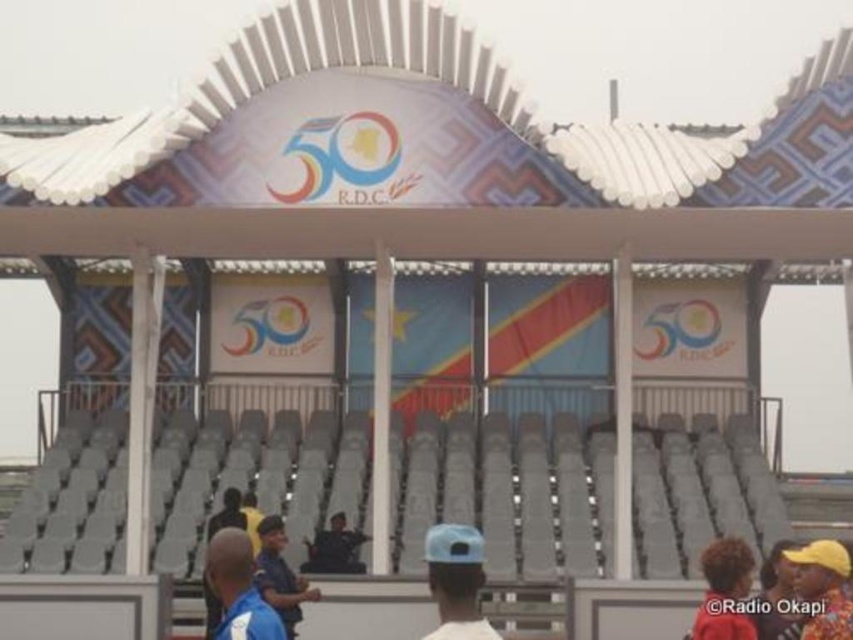
Consider the image. Does yellow fabric hat at upper right have a greater height compared to yellow fabric cap at lower right?

Yes, yellow fabric hat at upper right is taller than yellow fabric cap at lower right.

What do you see at coordinates (822, 588) in the screenshot? This screenshot has width=853, height=640. I see `yellow fabric hat at upper right` at bounding box center [822, 588].

At what (x,y) coordinates should I click in order to perform the action: click on yellow fabric hat at upper right. Please return your answer as a coordinate pair (x, y). This screenshot has height=640, width=853. Looking at the image, I should click on point(822,588).

What do you see at coordinates (546, 497) in the screenshot? This screenshot has height=640, width=853. I see `gray plastic seats at lower center` at bounding box center [546, 497].

Which is behind, point (683, 452) or point (234, 572)?

The point (683, 452) is behind.

Is point (270, 486) positioned behind point (231, 621)?

Yes, point (270, 486) is behind point (231, 621).

You are a GUI agent. You are given a task and a screenshot of the screen. Output one action in this format:
    pyautogui.click(x=<x>, y=<y>)
    Task: Click on the gray plastic seats at lower center
    
    Given the screenshot: What is the action you would take?
    pyautogui.click(x=546, y=497)

Between point (442, 528) and point (740, 614), which one is positioned in front?

Point (442, 528) is in front.

Based on the photo, can you confirm if blue matte cap at center is positioned to the right of red fabric person at lower right?

In fact, blue matte cap at center is to the left of red fabric person at lower right.

Find the location of a particular element. The image size is (853, 640). blue matte cap at center is located at coordinates (456, 580).